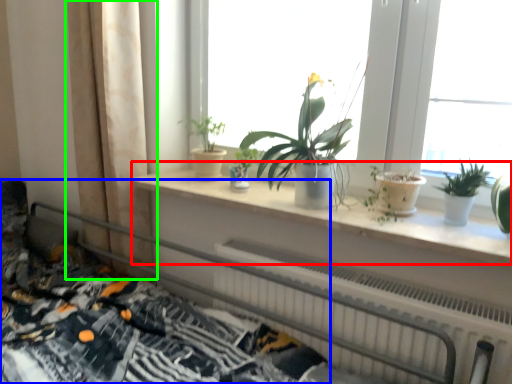
Question: Which object is positioned closest to window sill (highlighted by a red box)? Select from bed (highlighted by a blue box) and curtain (highlighted by a green box).

Choices:
 (A) bed
 (B) curtain

Answer: (B)